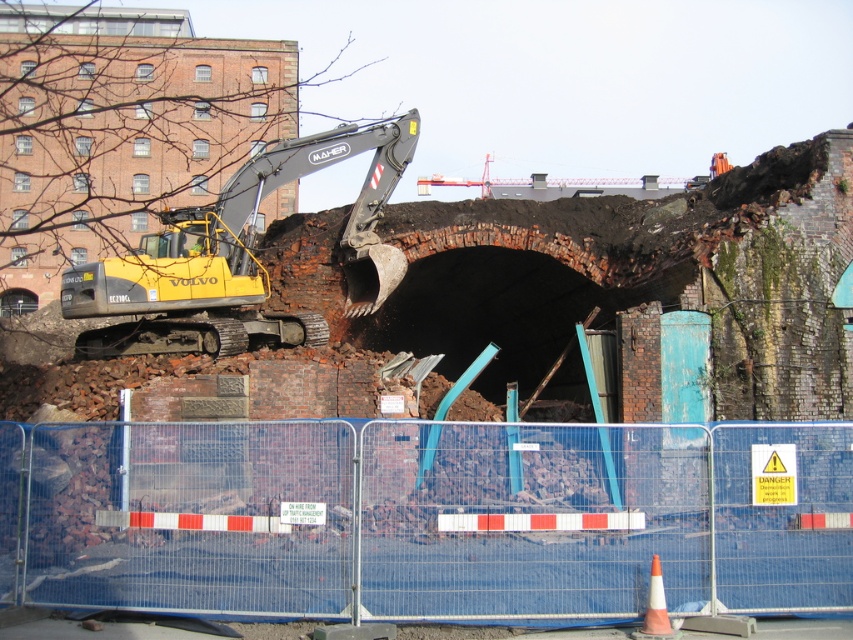
Question: Which of the following is the closest to the observer?

Choices:
 (A) (215, 288)
 (B) (4, 452)

Answer: (B)

Question: Is the position of blue mesh fence at center less distant than that of yellow rubber excavator at left?

Choices:
 (A) yes
 (B) no

Answer: (A)

Question: Which of the following is the farthest from the observer?

Choices:
 (A) (300, 326)
 (B) (271, 529)

Answer: (A)

Question: Is blue mesh fence at center positioned at the back of yellow rubber excavator at left?

Choices:
 (A) no
 (B) yes

Answer: (A)

Question: Which point is farther from the camera taking this photo?

Choices:
 (A) (367, 134)
 (B) (212, 540)

Answer: (A)

Question: Is blue mesh fence at center to the left of yellow rubber excavator at left from the viewer's perspective?

Choices:
 (A) no
 (B) yes

Answer: (A)